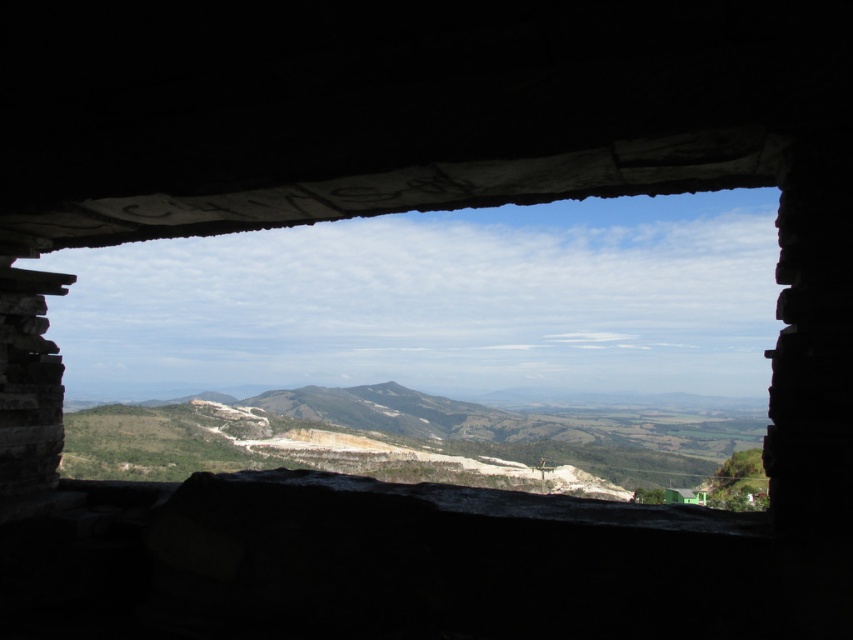
You are standing inside a stone structure and looking through the stone window at center. There is a green grassy mountain at center in the distance. Which object is closer to you?

The stone window at center is closer to the viewer than the green grassy mountain at center.